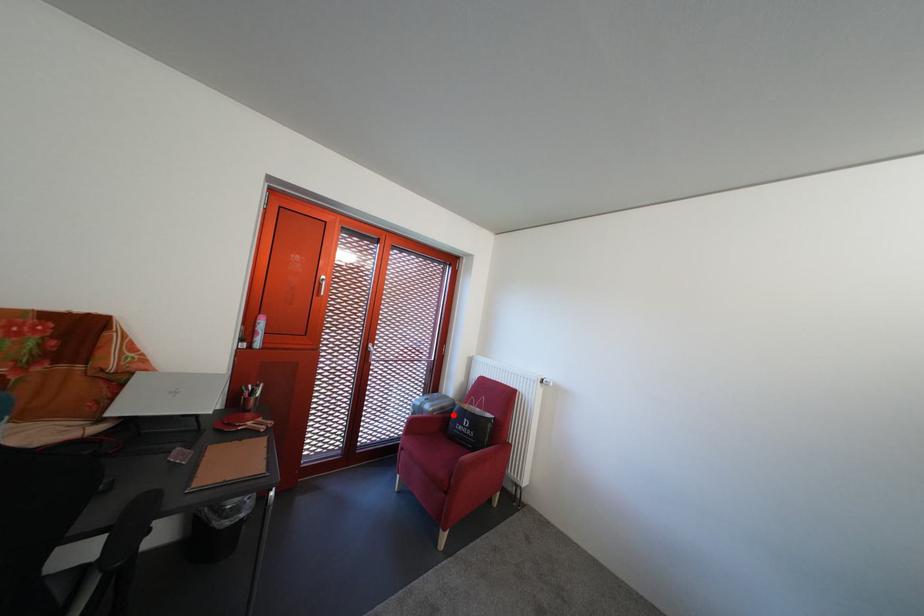
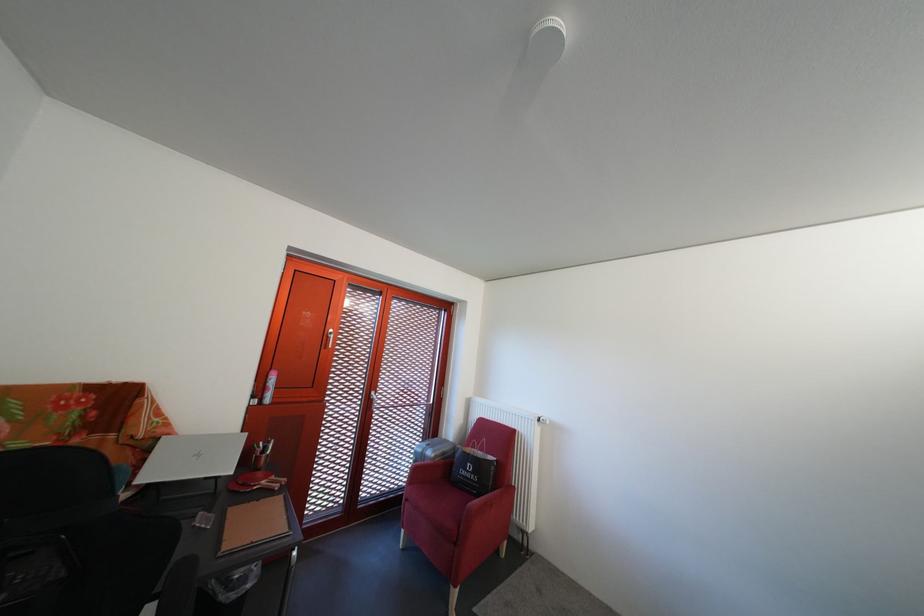
Where in the second image is the point corresponding to the highlighted location from the first image?

(455, 460)